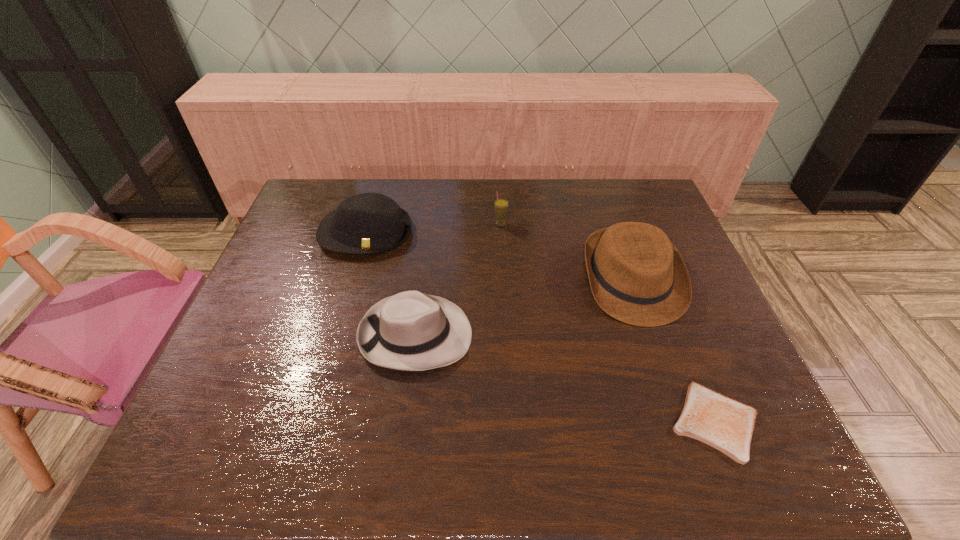
Locate an element on the screen. object positioned at the left edge is located at coordinates (368, 223).

I want to click on fedora positioned at the right edge, so click(x=637, y=276).

Where is `toast that is at the right edge`? Image resolution: width=960 pixels, height=540 pixels. toast that is at the right edge is located at coordinates (724, 423).

Identify the location of object situated at the far left corner. (368, 223).

Find the location of a particular element. The image size is (960, 540). object that is at the near right corner is located at coordinates (724, 423).

At what (x,y) coordinates should I click in order to perform the action: click on free space at the far edge. Please return your answer as a coordinate pair (x, y). Looking at the image, I should click on (424, 195).

The image size is (960, 540). Find the location of `free region at the near edge`. free region at the near edge is located at coordinates (561, 456).

You are a GUI agent. You are given a task and a screenshot of the screen. Output one action in this format:
    pyautogui.click(x=<x>, y=<y>)
    Task: Click on the vacant space at the left edge of the desktop
    
    Given the screenshot: What is the action you would take?
    pyautogui.click(x=217, y=422)

Where is `vacant area at the right edge of the desktop`? The width and height of the screenshot is (960, 540). vacant area at the right edge of the desktop is located at coordinates pos(691,325).

I want to click on vacant space at the far left corner of the desktop, so 341,181.